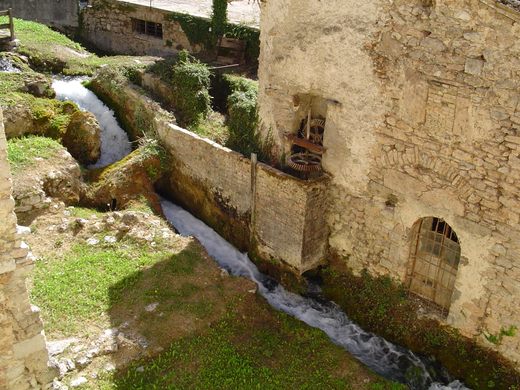
Locate an element on the screen. This screenshot has width=520, height=390. archway is located at coordinates (446, 214).